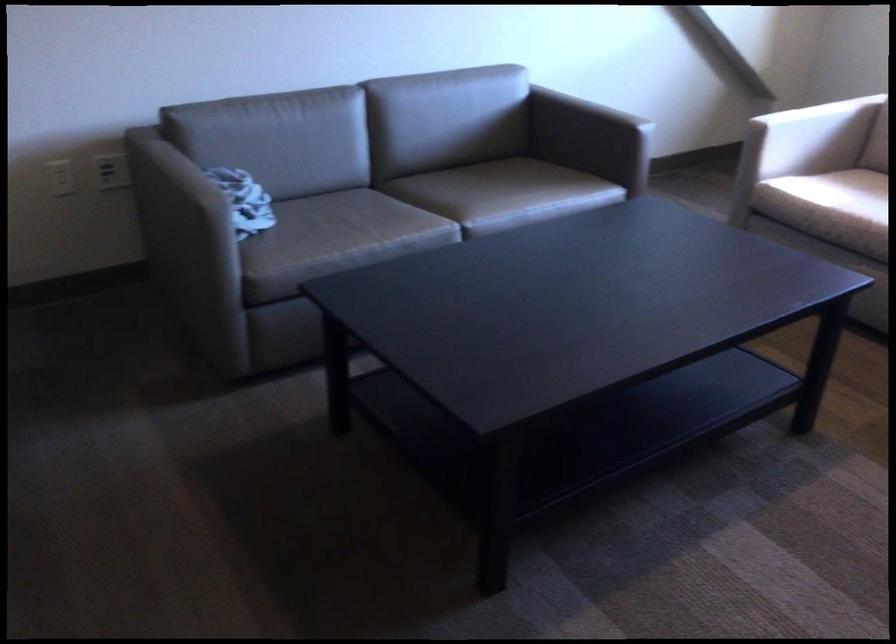
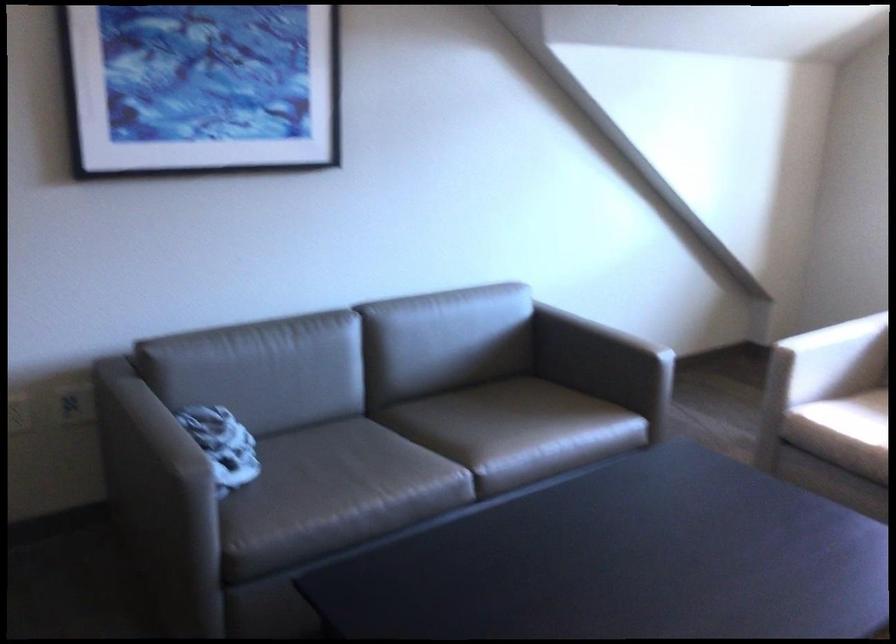
In a continuous first-person perspective shot, in which direction is the camera moving?

The cameraman moved toward left, forward.